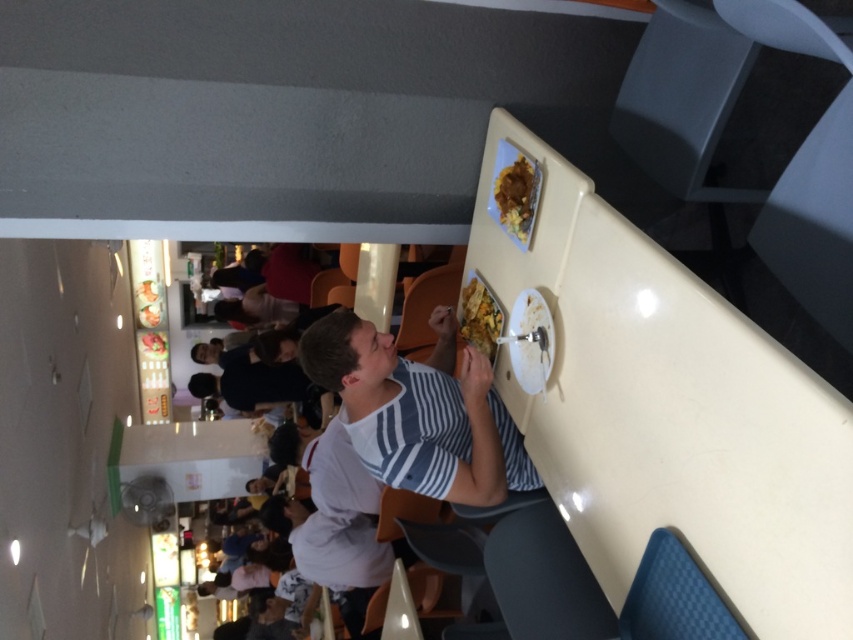
Is white striped shirt at center above golden crispy fries at upper center?

Incorrect, white striped shirt at center is not positioned above golden crispy fries at upper center.

Does white striped shirt at center have a smaller size compared to golden crispy fries at upper center?

No, white striped shirt at center is not smaller than golden crispy fries at upper center.

This screenshot has height=640, width=853. What do you see at coordinates (421, 410) in the screenshot?
I see `white striped shirt at center` at bounding box center [421, 410].

In order to click on white striped shirt at center in this screenshot , I will do `click(421, 410)`.

Is yellow matte food at upper right to the left of golden crispy fries at upper center from the viewer's perspective?

In fact, yellow matte food at upper right is to the right of golden crispy fries at upper center.

Is the position of yellow matte food at upper right less distant than that of golden crispy fries at upper center?

Yes, yellow matte food at upper right is in front of golden crispy fries at upper center.

Where is `yellow matte food at upper right`? This screenshot has height=640, width=853. yellow matte food at upper right is located at coordinates (515, 196).

Between yellow matte food at upper right and matte white plate at upper center, which one appears on the left side from the viewer's perspective?

From the viewer's perspective, matte white plate at upper center appears more on the left side.

Can you confirm if yellow matte food at upper right is taller than matte white plate at upper center?

Incorrect, yellow matte food at upper right's height is not larger of matte white plate at upper center's.

This screenshot has width=853, height=640. What are the coordinates of `yellow matte food at upper right` in the screenshot? It's located at (515, 196).